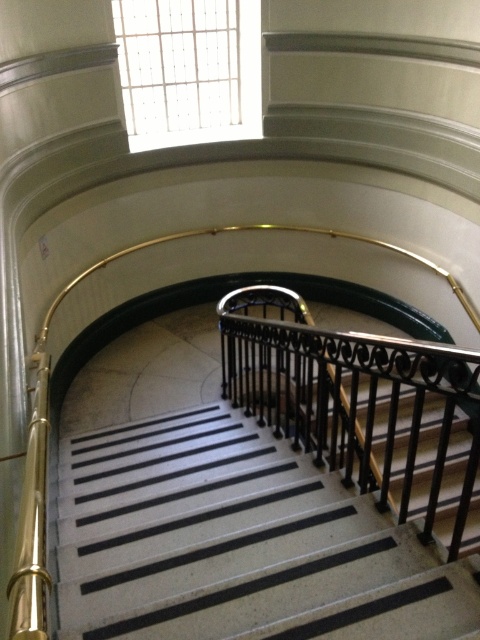
You are an interior designer assessing the staircase area. Given the space constraints, which object between the black textured stairs at center and the black wrought iron at center takes up more area?

The black wrought iron at center takes up more area than the black textured stairs at center because the stairs occupy less space according to the description.

Based on the scene description, where exactly is the black textured stairs at center located in terms of coordinates?

The black textured stairs at center are located at point coordinates of (236, 541).